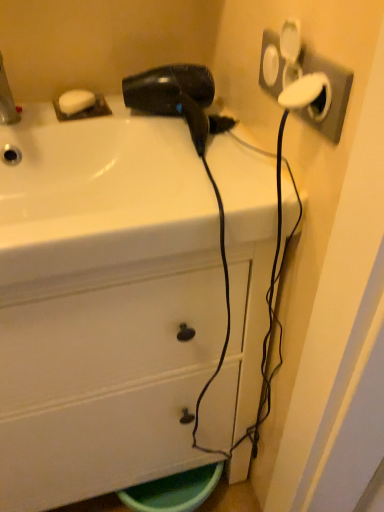
Locate an element on the screen. This screenshot has height=512, width=384. free location to the right of white matte soap at upper left is located at coordinates pos(141,117).